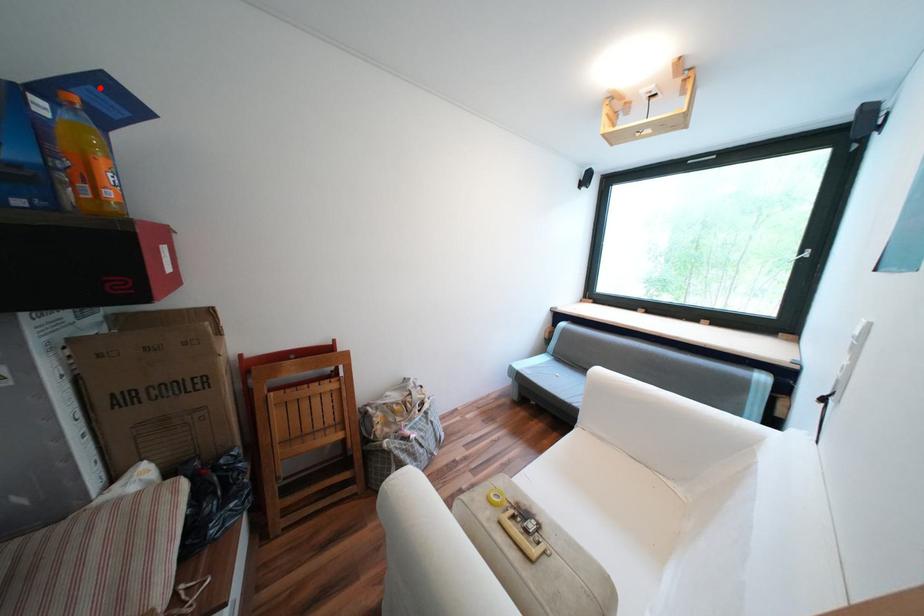
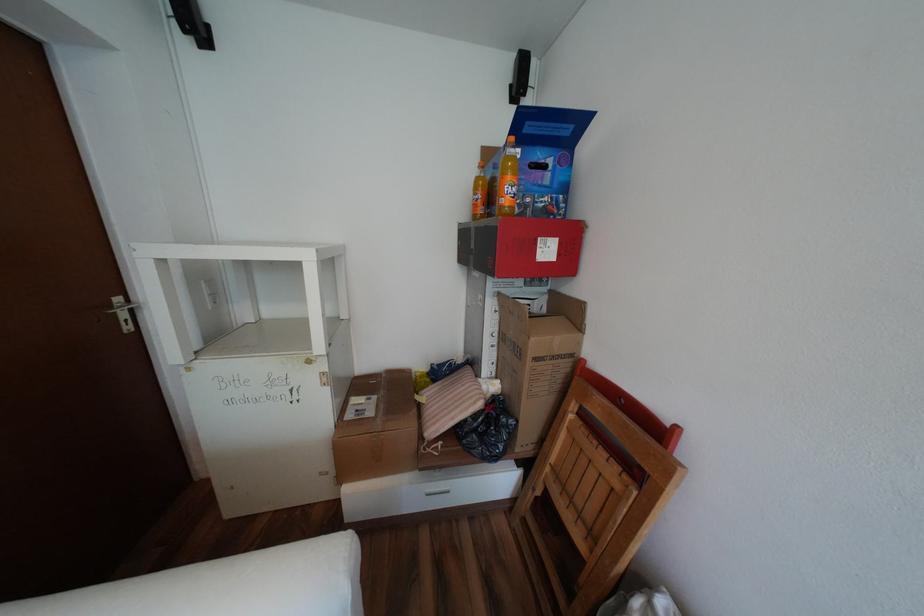
Question: A red point is marked in image1. In image2, is the corresponding 3D point closer to the camera or farther? Reply with the corresponding letter.

Choices:
 (A) The corresponding 3D point is closer.
 (B) The corresponding 3D point is farther.

Answer: (A)